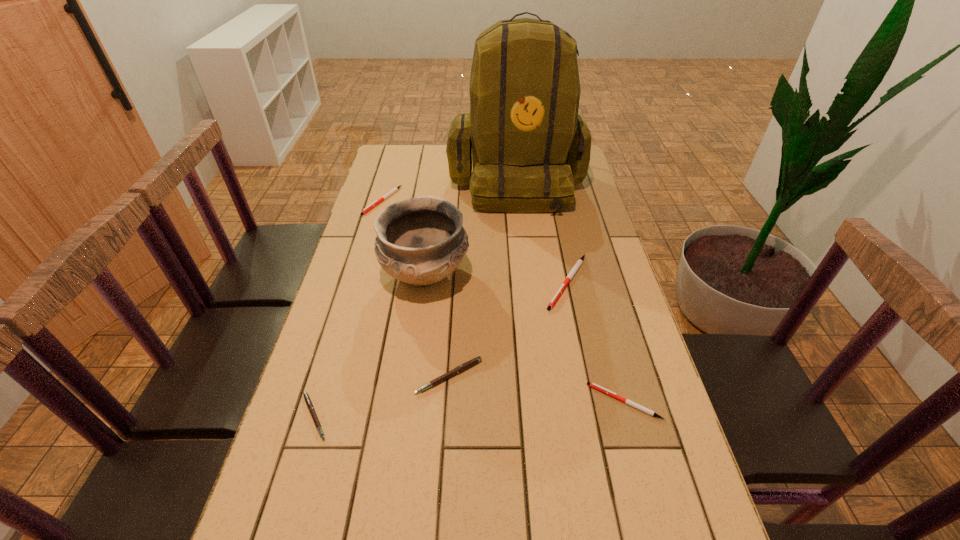
Find the location of `free space located on the front-facing side of the tallest object`. free space located on the front-facing side of the tallest object is located at coordinates (526, 272).

At what (x,y) coordinates should I click in order to perform the action: click on free region located on the front of the pottery. Please return your answer as a coordinate pair (x, y). Looking at the image, I should click on (416, 351).

The image size is (960, 540). I want to click on vacant space situated on the clicker of the second farthest pen, so click(577, 332).

Where is `vacant space located at the nib of the bigger pink pen`? vacant space located at the nib of the bigger pink pen is located at coordinates (442, 496).

At what (x,y) coordinates should I click in order to perform the action: click on vacant space positioned on the clicker of the farthest white pen. Please return your answer as a coordinate pair (x, y). Looking at the image, I should click on (365, 260).

This screenshot has height=540, width=960. In order to click on free location located 0.170m at the nib of the left pink pen in this screenshot , I will do `click(409, 416)`.

At what (x,y) coordinates should I click in order to perform the action: click on vacant area situated on the clicker of the smallest white pen. Please return your answer as a coordinate pair (x, y). This screenshot has height=540, width=960. Looking at the image, I should click on pyautogui.click(x=470, y=401).

In order to click on blank area located on the clicker of the smallest white pen in this screenshot , I will do tap(518, 401).

Locate an element on the screen. vacant space located on the clicker of the smallest white pen is located at coordinates (417, 401).

Where is `object located in the far edge section of the desktop`? The image size is (960, 540). object located in the far edge section of the desktop is located at coordinates (529, 147).